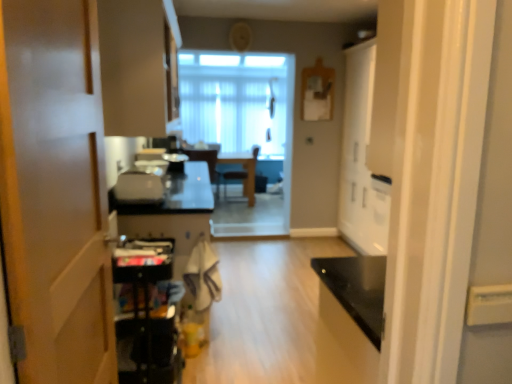
Question: From the image's perspective, relative to white glossy cabinet at right, positioned as the 1th door in right-to-left order, is matte beige cabinet at upper left above or below?

Choices:
 (A) above
 (B) below

Answer: (A)

Question: From a real-world perspective, relative to white glossy cabinet at right, which is the 2th door in left-to-right order, is matte beige cabinet at upper left vertically above or below?

Choices:
 (A) below
 (B) above

Answer: (B)

Question: Which object is positioned closest to the metallic black cart at lower left, placed as the first appliance when sorted from front to back?

Choices:
 (A) white glossy cabinet at right, positioned as the 1th door in right-to-left order
 (B) matte white chair at center, which is the first chair in left-to-right order
 (C) satin silver toaster at center, placed as the 2th appliance when sorted from bottom to top
 (D) wooden chair at center, acting as the first chair starting from the right
 (E) satin black toaster at center, marked as the first appliance in a back-to-front arrangement

Answer: (C)

Question: Which is nearer to the translucent glass window at center?

Choices:
 (A) metallic black cart at lower left, which appears as the third appliance when viewed from the top
 (B) matte wood door at left, the 1th door viewed from the front
 (C) satin black toaster at center, placed as the third appliance when sorted from front to back
 (D) matte white chair at center, which is the first chair in left-to-right order
 (E) satin silver toaster at center, placed as the 2th appliance when sorted from bottom to top

Answer: (D)